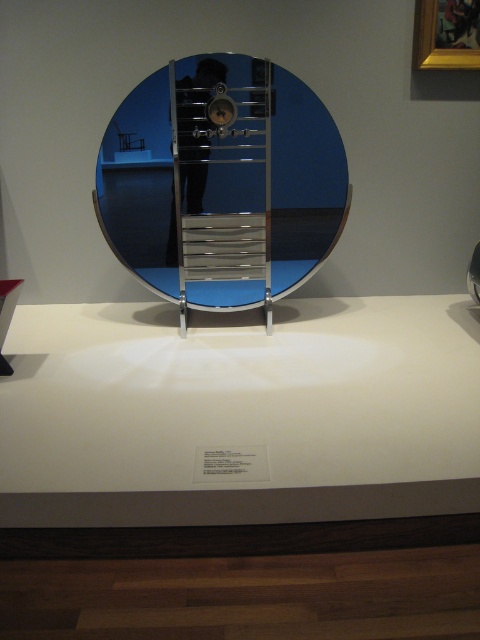
Between point (290, 113) and point (196, 106), which one is positioned behind?

Point (290, 113)

Does point (284, 72) lie in front of point (183, 108)?

No, it is not.

Is point (180, 189) less distant than point (200, 124)?

That is False.

The image size is (480, 640). I want to click on polished chrome mirror at center, so click(222, 182).

Does white glossy counter top at center appear under polished chrome ladder at center?

Correct, white glossy counter top at center is located below polished chrome ladder at center.

Is white glossy counter top at center closer to camera compared to polished chrome ladder at center?

Yes, it is.

Is point (396, 497) positioned after point (266, 68)?

No, it is in front of (266, 68).

Where is `white glossy counter top at center`? Image resolution: width=480 pixels, height=640 pixels. white glossy counter top at center is located at coordinates (240, 412).

From the picture: Is polished chrome mirror at center to the left of polished chrome ladder at center from the viewer's perspective?

No, polished chrome mirror at center is not to the left of polished chrome ladder at center.

Is the position of polished chrome mirror at center more distant than that of polished chrome ladder at center?

Yes, polished chrome mirror at center is behind polished chrome ladder at center.

Find the location of a particular element. polished chrome mirror at center is located at coordinates (222, 182).